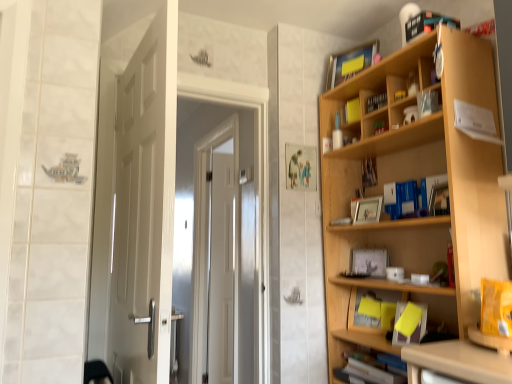
Question: Is light wood bookcase at right further to the viewer compared to yellow paper at lower right, the ninth book from the top?

Choices:
 (A) no
 (B) yes

Answer: (B)

Question: Does light wood bookcase at right have a lesser height compared to yellow paper at lower right, the ninth book from the top?

Choices:
 (A) yes
 (B) no

Answer: (B)

Question: Is light wood bookcase at right positioned before yellow paper at lower right, which is the 2th book from bottom to top?

Choices:
 (A) no
 (B) yes

Answer: (A)

Question: Is light wood bookcase at right far from yellow paper at lower right, the ninth book from the top?

Choices:
 (A) yes
 (B) no

Answer: (B)

Question: From a real-world perspective, is light wood bookcase at right below yellow paper at lower right, which is the 2th book from bottom to top?

Choices:
 (A) yes
 (B) no

Answer: (B)

Question: From their relative heights in the image, would you say light wood bookcase at right is taller or shorter than black matte book at upper right, acting as the first book starting from the top?

Choices:
 (A) short
 (B) tall

Answer: (B)

Question: Considering the relative positions of light wood bookcase at right and black matte book at upper right, acting as the first book starting from the top, in the image provided, is light wood bookcase at right to the left or to the right of black matte book at upper right, acting as the first book starting from the top,?

Choices:
 (A) left
 (B) right

Answer: (A)

Question: Is point coord(330,119) closer or farther from the camera than point coord(436,23)?

Choices:
 (A) closer
 (B) farther

Answer: (B)

Question: Relative to black matte book at upper right, acting as the first book starting from the top, is light wood bookcase at right in front or behind?

Choices:
 (A) behind
 (B) front

Answer: (B)

Question: Is matte yellow book at upper right, the second book viewed from the top, bigger or smaller than wooden photo frame at upper right, arranged as the 3th book when ordered from the bottom?

Choices:
 (A) small
 (B) big

Answer: (B)

Question: Which is correct: matte yellow book at upper right, positioned as the 9th book in bottom-to-top order, is inside wooden photo frame at upper right, positioned as the 8th book in top-to-bottom order, or outside of it?

Choices:
 (A) inside
 (B) outside

Answer: (B)

Question: From a real-world perspective, relative to wooden photo frame at upper right, positioned as the 8th book in top-to-bottom order, is matte yellow book at upper right, the second book viewed from the top, vertically above or below?

Choices:
 (A) below
 (B) above

Answer: (B)

Question: In terms of height, does matte yellow book at upper right, the second book viewed from the top, look taller or shorter compared to wooden photo frame at upper right, arranged as the 3th book when ordered from the bottom?

Choices:
 (A) tall
 (B) short

Answer: (A)

Question: In terms of width, does matte plastic book at upper right, arranged as the fifth book when viewed from the top, look wider or thinner when compared to yellow matte bookshelf at upper center, the fourth book when ordered from top to bottom?

Choices:
 (A) wide
 (B) thin

Answer: (A)

Question: In terms of size, does matte plastic book at upper right, which appears as the sixth book when ordered from the bottom, appear bigger or smaller than yellow matte bookshelf at upper center, arranged as the 7th book when ordered from the bottom?

Choices:
 (A) big
 (B) small

Answer: (A)